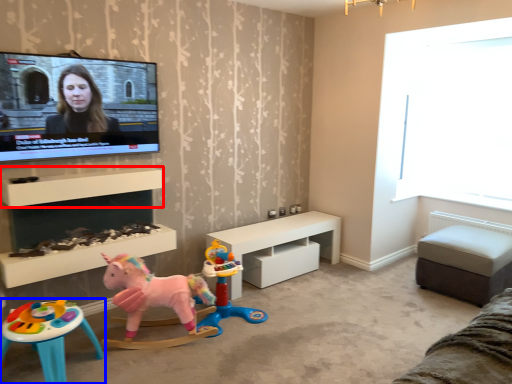
Question: Which point is further to the camera, shelf (highlighted by a red box) or toy (highlighted by a blue box)?

Choices:
 (A) shelf
 (B) toy

Answer: (A)